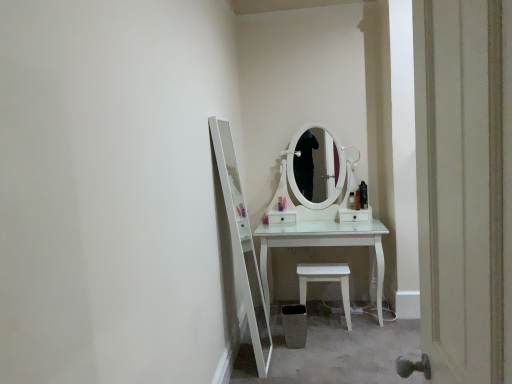
Question: Is white wooden door at right wider or thinner than matte orange bottle at center, the 2th toiletry viewed from the right?

Choices:
 (A) wide
 (B) thin

Answer: (A)

Question: From a real-world perspective, is white wooden door at right positioned above or below matte orange bottle at center, which is the 4th toiletry from left to right?

Choices:
 (A) below
 (B) above

Answer: (B)

Question: Estimate the real-world distances between objects in this image. Which object is closer to the matte orange bottle at center, which is the 4th toiletry from left to right?

Choices:
 (A) matte black hairbrush at center, positioned as the third toiletry in right-to-left order
 (B) translucent plastic spray bottle at right, acting as the fifth toiletry starting from the left
 (C) translucent plastic bottle at center, the second toiletry from the left
 (D) white wooden door at right
 (E) white plastic stool at lower center

Answer: (A)

Question: Estimate the real-world distances between objects in this image. Which object is closer to the translucent plastic bottle at center, which is counted as the 4th toiletry, starting from the right?

Choices:
 (A) translucent plastic spray bottle at right, positioned as the first toiletry in right-to-left order
 (B) matte orange bottle at center, which is the 4th toiletry from left to right
 (C) matte black hairbrush at center, positioned as the third toiletry in right-to-left order
 (D) matte plastic container at center, which ranks as the 5th toiletry in right-to-left order
 (E) white plastic stool at lower center

Answer: (D)